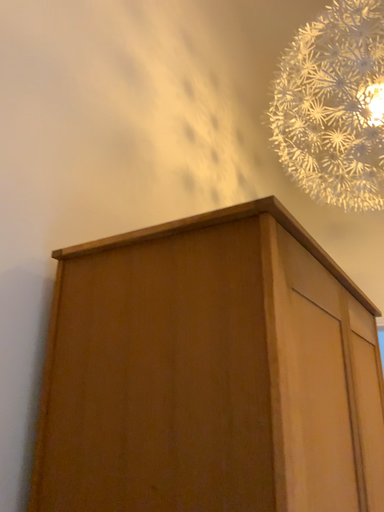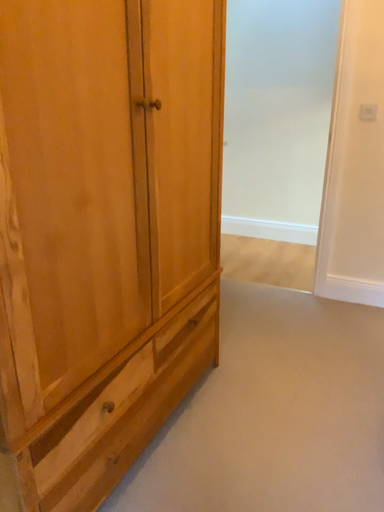
Question: Which way did the camera rotate in the video?

Choices:
 (A) rotated upward
 (B) rotated downward

Answer: (B)